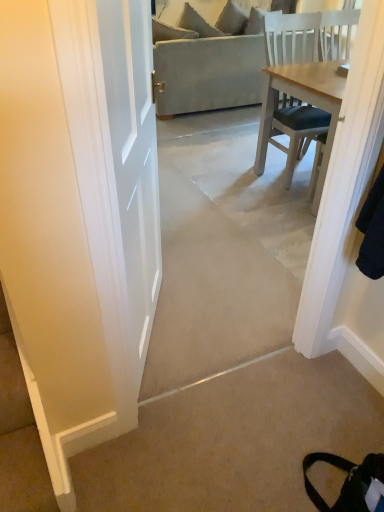
Find the location of a particular element. beige carpet at lower right is located at coordinates (235, 439).

What do you see at coordinates (235, 439) in the screenshot? I see `beige carpet at lower right` at bounding box center [235, 439].

What is the approximate height of beige fabric couch at center?

beige fabric couch at center is 3.42 feet tall.

This screenshot has width=384, height=512. What do you see at coordinates (206, 65) in the screenshot?
I see `beige fabric couch at center` at bounding box center [206, 65].

Locate an element on the screen. beige fabric couch at center is located at coordinates coord(206,65).

I want to click on beige carpet at lower right, so click(235, 439).

Which is more to the right, beige fabric couch at center or beige carpet at lower right?

From the viewer's perspective, beige fabric couch at center appears more on the right side.

Is beige fabric couch at center positioned behind beige carpet at lower right?

Yes, beige fabric couch at center is further from the viewer.

Is point (157, 61) positioned in front of point (266, 358)?

No, it is not.

From the image's perspective, is beige fabric couch at center above or below beige carpet at lower right?

Based on their image positions, beige fabric couch at center is located above beige carpet at lower right.

From a real-world perspective, is beige fabric couch at center physically above beige carpet at lower right?

Yes.

Considering the sizes of objects beige fabric couch at center and beige carpet at lower right in the image provided, who is thinner, beige fabric couch at center or beige carpet at lower right?

beige carpet at lower right is thinner.

Who is shorter, beige fabric couch at center or beige carpet at lower right?

Standing shorter between the two is beige carpet at lower right.

Considering the relative sizes of beige fabric couch at center and beige carpet at lower right in the image provided, is beige fabric couch at center bigger than beige carpet at lower right?

Indeed, beige fabric couch at center has a larger size compared to beige carpet at lower right.

Would you say beige fabric couch at center is outside beige carpet at lower right?

Yes, beige fabric couch at center is not within beige carpet at lower right.

Is beige fabric couch at center touching beige carpet at lower right?

beige fabric couch at center and beige carpet at lower right are clearly separated.

From the picture: Is beige fabric couch at center oriented away from beige carpet at lower right?

Yes, beige fabric couch at center is facing away from beige carpet at lower right.

How different are the orientations of beige fabric couch at center and beige carpet at lower right in degrees?

The angle between the facing direction of beige fabric couch at center and the facing direction of beige carpet at lower right is 0.553 degrees.

How distant is beige fabric couch at center from beige carpet at lower right?

beige fabric couch at center is 3.32 meters from beige carpet at lower right.

Identify the location of concrete in front of the beige fabric couch at center. The image size is (384, 512). (235, 439).

Which object is positioned more to the right, beige carpet at lower right or beige fabric couch at center?

Positioned to the right is beige fabric couch at center.

Is the position of beige carpet at lower right more distant than that of beige fabric couch at center?

No, beige carpet at lower right is closer to the camera.

Which is closer to the camera, (166, 469) or (180, 34)?

Clearly, point (166, 469) is closer to the camera than point (180, 34).

From the image's perspective, is beige carpet at lower right located above or below beige fabric couch at center?

beige carpet at lower right is below beige fabric couch at center.

From a real-world perspective, is beige carpet at lower right on beige fabric couch at center?

Incorrect, from a real-world perspective, beige carpet at lower right is lower than beige fabric couch at center.

In terms of width, does beige carpet at lower right look wider or thinner when compared to beige fabric couch at center?

Clearly, beige carpet at lower right has less width compared to beige fabric couch at center.

Can you confirm if beige carpet at lower right is shorter than beige fabric couch at center?

Yes.

Is beige carpet at lower right smaller than beige fabric couch at center?

Correct, beige carpet at lower right occupies less space than beige fabric couch at center.

Would you say beige carpet at lower right is outside beige fabric couch at center?

Yes, beige carpet at lower right is outside of beige fabric couch at center.

Is beige carpet at lower right next to beige fabric couch at center?

beige carpet at lower right and beige fabric couch at center are not in contact.

Based on the photo, could you tell me if beige carpet at lower right is facing beige fabric couch at center?

No.

How many degrees apart are the facing directions of beige carpet at lower right and beige fabric couch at center?

0.553 degrees separate the facing orientations of beige carpet at lower right and beige fabric couch at center.

The width and height of the screenshot is (384, 512). Find the location of `studio couch above the beige carpet at lower right (from the image's perspective)`. studio couch above the beige carpet at lower right (from the image's perspective) is located at coordinates (206, 65).

Where is `studio couch located on the right of beige carpet at lower right`? studio couch located on the right of beige carpet at lower right is located at coordinates (206, 65).

At what (x,y) coordinates should I click in order to perform the action: click on studio couch behind the beige carpet at lower right. Please return your answer as a coordinate pair (x, y). The width and height of the screenshot is (384, 512). Looking at the image, I should click on (206, 65).